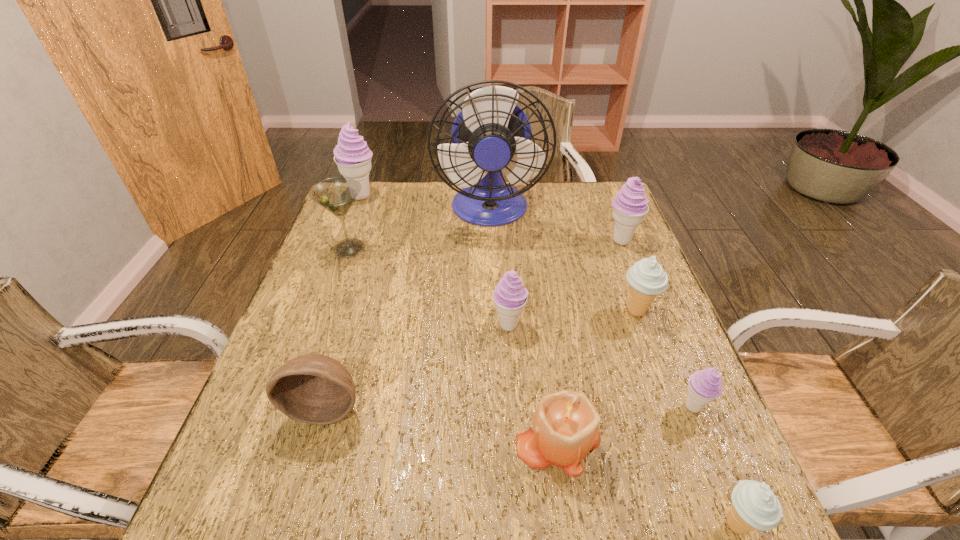
The image size is (960, 540). In the image, there is a desktop. Find the location of `vacant space at the left edge`. vacant space at the left edge is located at coordinates 276,456.

The width and height of the screenshot is (960, 540). What are the coordinates of `vacant point at the right edge` in the screenshot? It's located at (674, 456).

Locate an element on the screen. The width and height of the screenshot is (960, 540). vacant space at the far left corner is located at coordinates (347, 217).

The height and width of the screenshot is (540, 960). Identify the location of vacant space at the far right corner of the desktop. (611, 197).

I want to click on vacant region at the near right corner of the desktop, so click(708, 520).

Identify the location of free point between the third smallest purple icecream and the martini. (485, 244).

Where is `vacant point located between the third biggest purple icecream and the beige candle`? The image size is (960, 540). vacant point located between the third biggest purple icecream and the beige candle is located at coordinates (534, 382).

The image size is (960, 540). I want to click on unoccupied area between the nearest purple icecream and the tallest object, so click(x=591, y=308).

This screenshot has width=960, height=540. Find the location of `unoccupied area between the bowl and the fifth nearest icecream`. unoccupied area between the bowl and the fifth nearest icecream is located at coordinates (473, 324).

You are a GUI agent. You are given a task and a screenshot of the screen. Output one action in this format:
    pyautogui.click(x=<x>, y=<y>)
    Task: Click on the free spot between the beige candle and the second biggest purple icecream
    
    Given the screenshot: What is the action you would take?
    pyautogui.click(x=589, y=340)